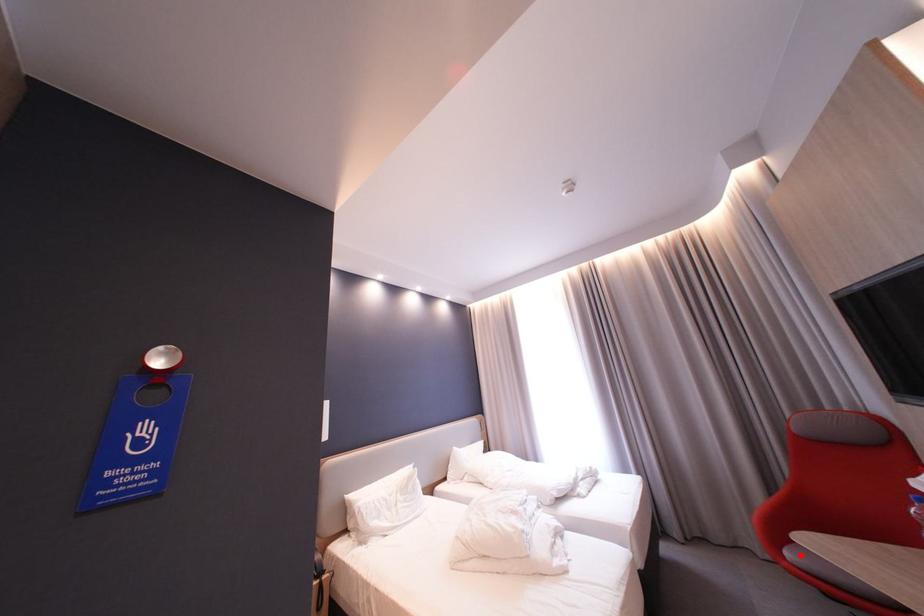
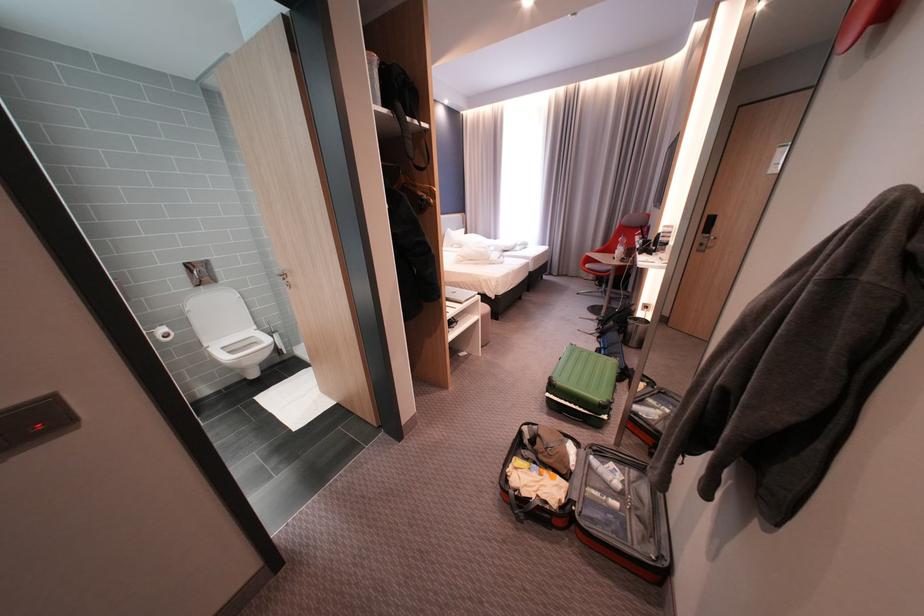
Where in the second image is the point corresponding to the highlighted location from the first image?

(598, 265)